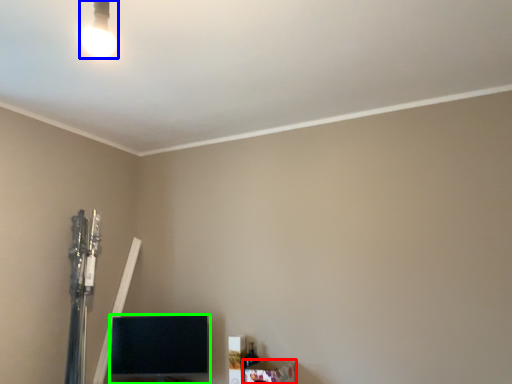
Question: Which object is the farthest from furniture (highlighted by a red box)? Choose among these: lamp (highlighted by a blue box) or furniture (highlighted by a green box).

Choices:
 (A) lamp
 (B) furniture

Answer: (A)